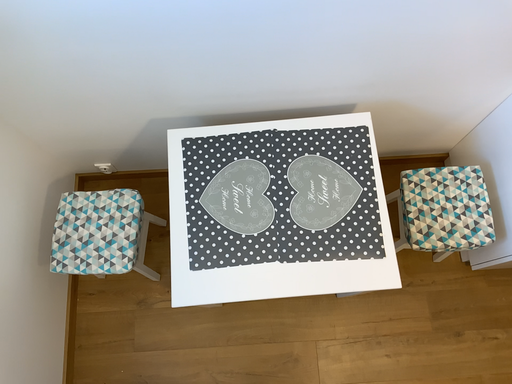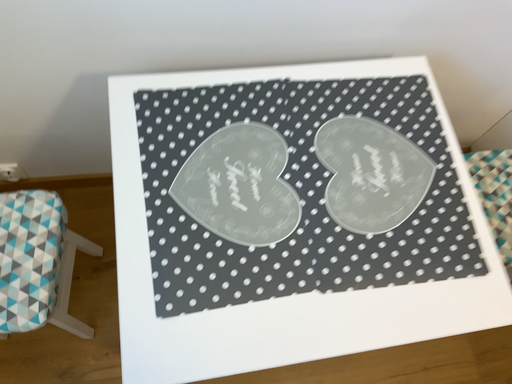
Question: Which way did the camera rotate in the video?

Choices:
 (A) rotated right
 (B) rotated left

Answer: (A)